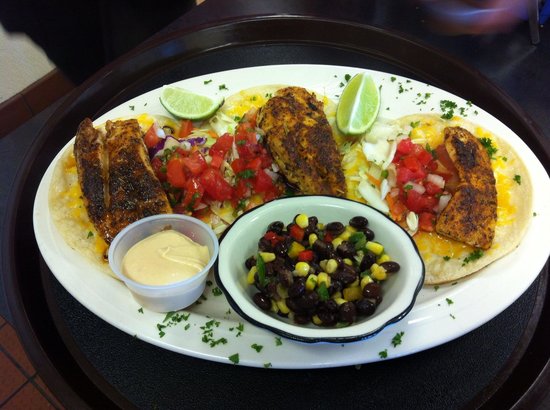
You are a GUI agent. You are given a task and a screenshot of the screen. Output one action in this format:
    pyautogui.click(x=<x>, y=<y>)
    Task: Click on the tray
    The width and height of the screenshot is (550, 410).
    Given the screenshot: What is the action you would take?
    pyautogui.click(x=267, y=44)